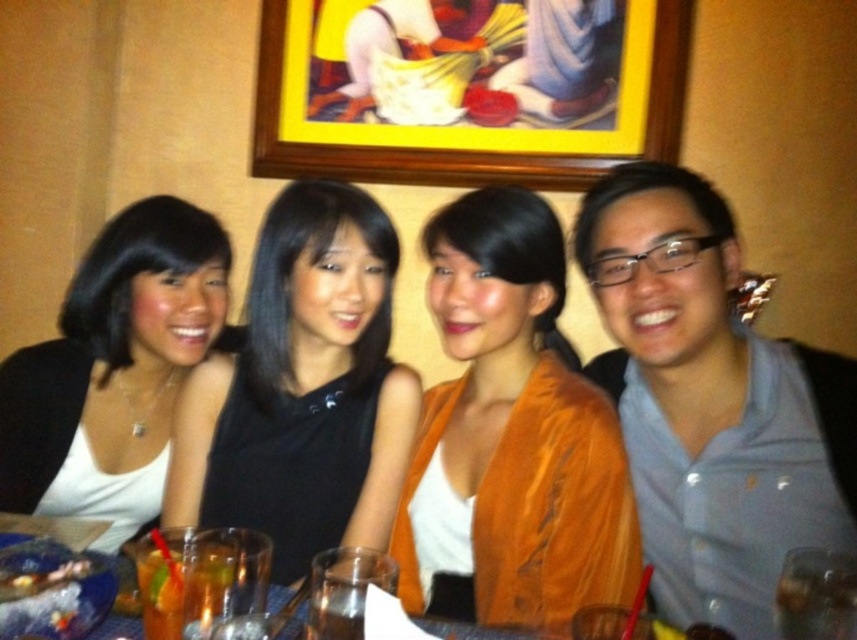
Who is taller, orange velvet jacket at center or black matte dress at center?

orange velvet jacket at center

Is orange velvet jacket at center positioned before black matte dress at center?

Yes, it is.

Between point (535, 244) and point (256, 490), which one is positioned behind?

The point (535, 244) is more distant.

Where is `orange velvet jacket at center`? This screenshot has width=857, height=640. orange velvet jacket at center is located at coordinates (512, 433).

Does yellow wood picture frame at upper center have a lesser width compared to white matte tank top at left?

No, yellow wood picture frame at upper center is not thinner than white matte tank top at left.

Who is shorter, yellow wood picture frame at upper center or white matte tank top at left?

Standing shorter between the two is yellow wood picture frame at upper center.

Is point (538, 17) in front of point (70, 400)?

No, it is behind (70, 400).

You are a GUI agent. You are given a task and a screenshot of the screen. Output one action in this format:
    pyautogui.click(x=<x>, y=<y>)
    Task: Click on the yellow wood picture frame at upper center
    The image size is (857, 640).
    Given the screenshot: What is the action you would take?
    pyautogui.click(x=468, y=88)

Between yellow wood picture frame at upper center and orange velvet jacket at center, which one has more height?

orange velvet jacket at center

Can you confirm if yellow wood picture frame at upper center is wider than orange velvet jacket at center?

Correct, the width of yellow wood picture frame at upper center exceeds that of orange velvet jacket at center.

I want to click on yellow wood picture frame at upper center, so click(468, 88).